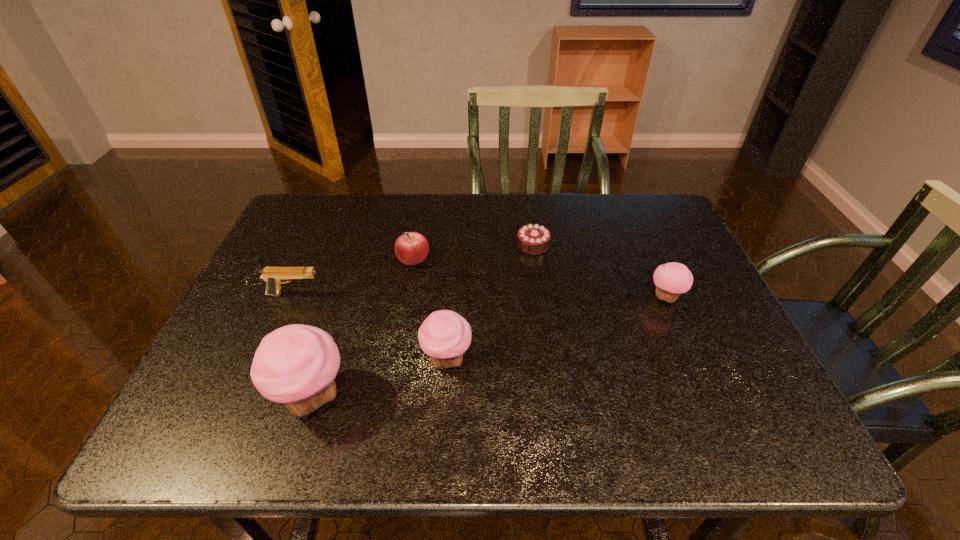
Locate an element on the screen. vacant area situated on the back of the tallest object is located at coordinates (340, 307).

Locate an element on the screen. The height and width of the screenshot is (540, 960). vacant space located on the back of the fourth object from left to right is located at coordinates (454, 252).

Identify the location of vacant space located on the back of the farthest cupcake. (627, 208).

I want to click on vacant space situated on the front of the apple, so click(x=404, y=314).

At what (x,y) coordinates should I click in order to perform the action: click on vacant space situated 0.130m at the barrel of the pistol. Please return your answer as a coordinate pair (x, y). The width and height of the screenshot is (960, 540). Looking at the image, I should click on (373, 294).

Locate an element on the screen. Image resolution: width=960 pixels, height=540 pixels. vacant space positioned 0.300m on the front of the chocolate cake is located at coordinates (546, 341).

Identify the location of object positioned at the far edge. The width and height of the screenshot is (960, 540). (533, 239).

This screenshot has width=960, height=540. Identify the location of object situated at the left edge. (273, 276).

Locate an element on the screen. object at the right edge is located at coordinates (671, 279).

The width and height of the screenshot is (960, 540). In the image, there is a desktop. In order to click on vacant space at the far edge in this screenshot , I will do click(x=492, y=202).